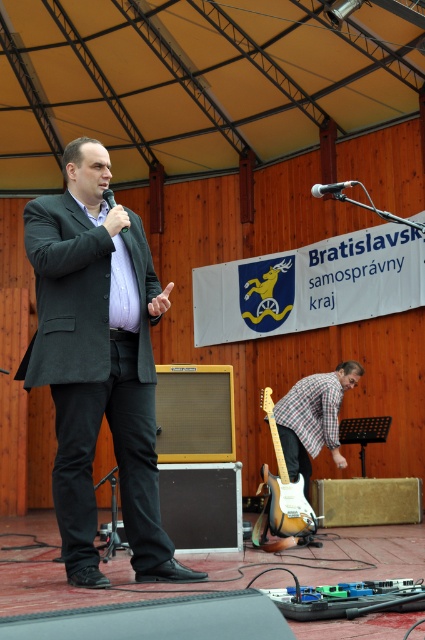
Is metallic silver microphone at upper center smaller than matte black microphone at upper center?

No.

Is point (343, 182) positioned in front of point (113, 200)?

No, it is behind (113, 200).

Identify the location of metallic silver microphone at upper center. (331, 188).

Can you confirm if sunburst wood electric guitar at lower center is bigger than matte black microphone at upper center?

Indeed, sunburst wood electric guitar at lower center has a larger size compared to matte black microphone at upper center.

Can you confirm if sunburst wood electric guitar at lower center is smaller than matte black microphone at upper center?

Incorrect, sunburst wood electric guitar at lower center is not smaller in size than matte black microphone at upper center.

What do you see at coordinates (283, 496) in the screenshot? I see `sunburst wood electric guitar at lower center` at bounding box center [283, 496].

Where is `sunburst wood electric guitar at lower center`? The image size is (425, 640). sunburst wood electric guitar at lower center is located at coordinates (283, 496).

Does matte black suit at center come in front of sunburst wood electric guitar at lower center?

Yes.

Between matte black suit at center and sunburst wood electric guitar at lower center, which one appears on the right side from the viewer's perspective?

sunburst wood electric guitar at lower center is more to the right.

The height and width of the screenshot is (640, 425). What are the coordinates of `matte black suit at center` in the screenshot? It's located at (98, 362).